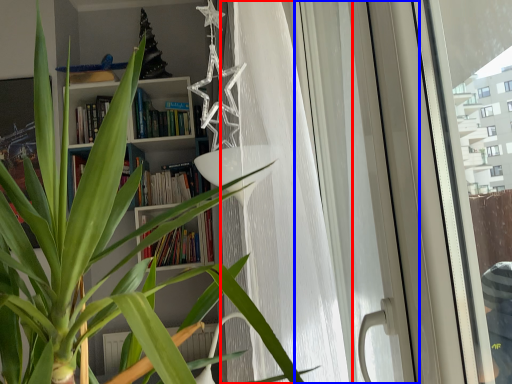
Question: Which object appears closest to the camera in this image, curtain (highlighted by a red box) or screen door (highlighted by a blue box)?

Choices:
 (A) curtain
 (B) screen door

Answer: (B)